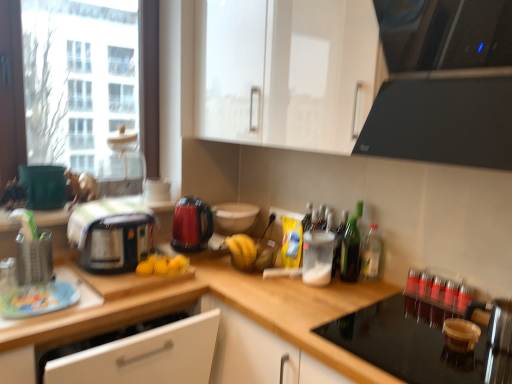
At what (x,y) coordinates should I click in order to perform the action: click on vacant space situated on the left part of red glass bottles at right, positioned as the 1th bottle in right-to-left order. Please return your answer as a coordinate pair (x, y). The height and width of the screenshot is (384, 512). Looking at the image, I should click on (367, 294).